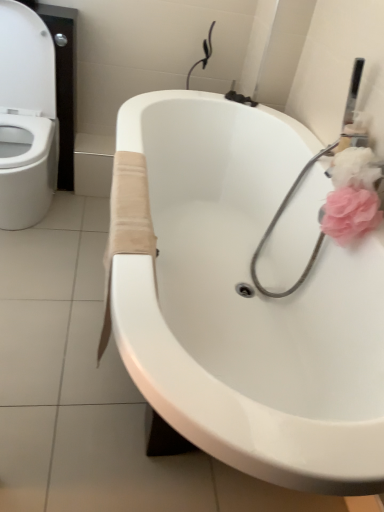
You are a GUI agent. You are given a task and a screenshot of the screen. Output one action in this format:
    pyautogui.click(x=<x>, y=<y>)
    Task: Click on the free spot above beige fabric towel at lower center (from a real-world perspective)
    
    Given the screenshot: What is the action you would take?
    pyautogui.click(x=131, y=200)